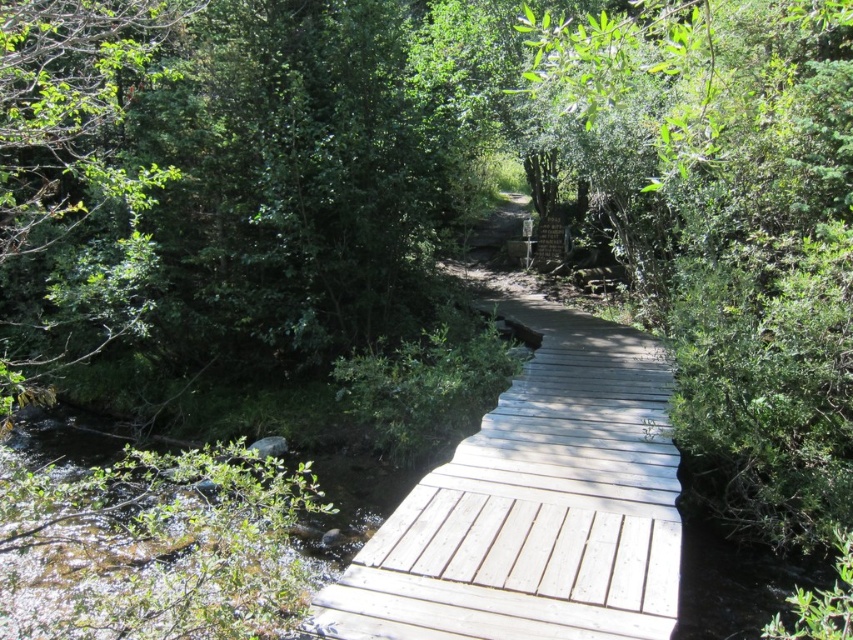
Does point (604, 474) lie behind point (28, 20)?

Yes, point (604, 474) is farther from viewer.

Which is above, light gray wooden bridge at center or green leafy tree at left?

green leafy tree at left is higher up.

Who is more forward, (500, 406) or (125, 33)?

Positioned in front is point (500, 406).

This screenshot has height=640, width=853. Identify the location of light gray wooden bridge at center. click(537, 506).